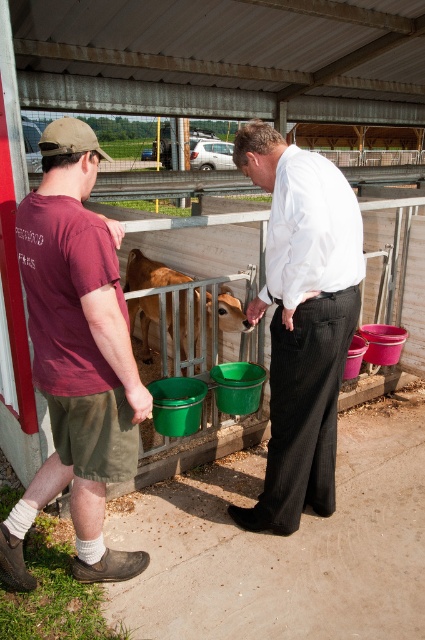
Question: Which point appears farthest from the camera in this image?

Choices:
 (A) (53, 385)
 (B) (141, 301)

Answer: (B)

Question: Can you confirm if maroon cotton t-shirt at left is smaller than brown matte calf at center?

Choices:
 (A) yes
 (B) no

Answer: (A)

Question: Estimate the real-world distances between objects in this image. Which object is farther from the maroon cotton t-shirt at left?

Choices:
 (A) brown matte calf at center
 (B) white smooth shirt at center

Answer: (A)

Question: From the image, what is the correct spatial relationship of white smooth shirt at center in relation to brown matte calf at center?

Choices:
 (A) right
 (B) left

Answer: (A)

Question: Which of the following is the farthest from the observer?

Choices:
 (A) maroon cotton t-shirt at left
 (B) white smooth shirt at center
 (C) brown matte calf at center

Answer: (C)

Question: Does maroon cotton t-shirt at left have a greater width compared to white smooth shirt at center?

Choices:
 (A) yes
 (B) no

Answer: (A)